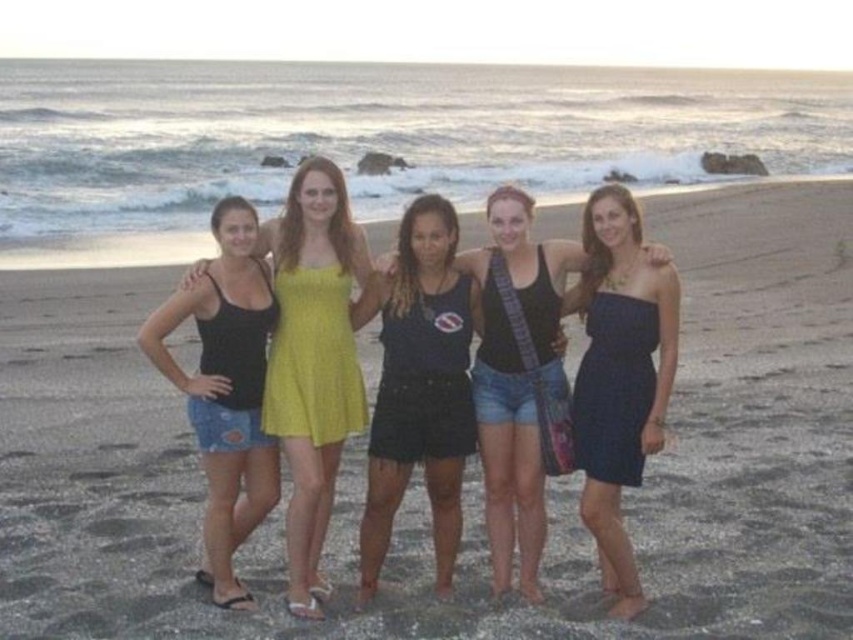
Question: Can you confirm if smooth sand at center is positioned to the right of matte yellow dress at center?

Choices:
 (A) no
 (B) yes

Answer: (B)

Question: Which point appears farthest from the camera in this image?

Choices:
 (A) (614, 381)
 (B) (193, 266)

Answer: (A)

Question: Where is smooth sand at center located in relation to navy blue strapless dress at center in the image?

Choices:
 (A) below
 (B) above

Answer: (B)

Question: Which is farther from the dark blue tank top at center?

Choices:
 (A) denim shorts at left
 (B) navy blue strapless dress at center
 (C) matte yellow dress at center
 (D) smooth sand at center

Answer: (D)

Question: Does denim shorts at left appear on the left side of dark blue tank top at center?

Choices:
 (A) yes
 (B) no

Answer: (A)

Question: Which object appears farthest from the camera in this image?

Choices:
 (A) dark blue tank top at center
 (B) navy blue strapless dress at center
 (C) matte yellow dress at center

Answer: (A)